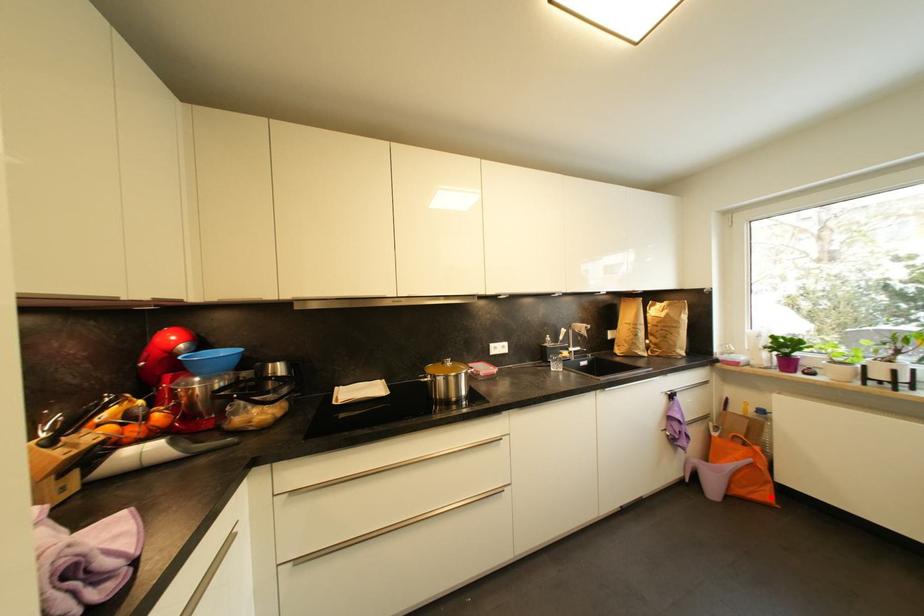
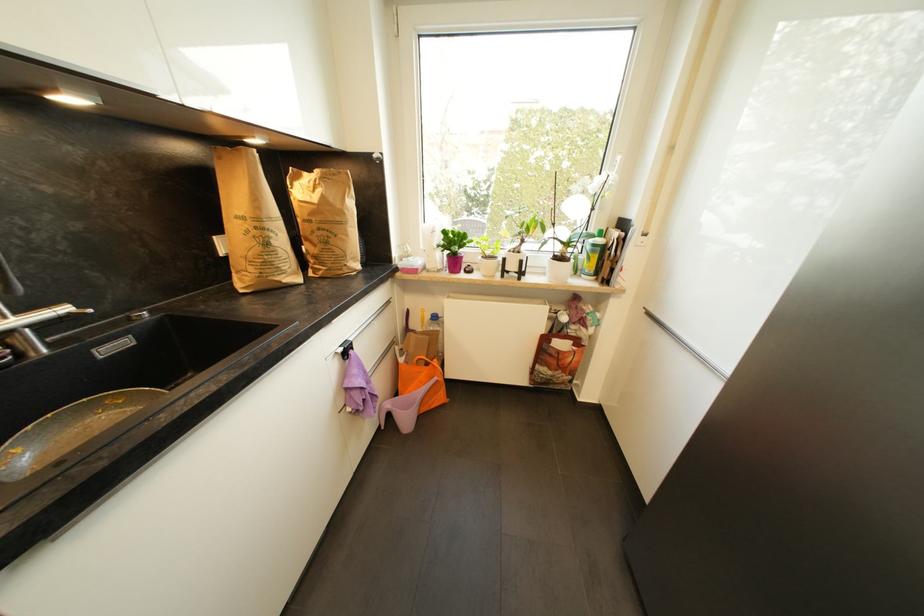
Question: I am providing you with two images of the same scene from different viewpoints. In image1, a red point is highlighted. Considering the same 3D point in image2, which of the following is correct?

Choices:
 (A) It is closer
 (B) It is farther

Answer: (B)